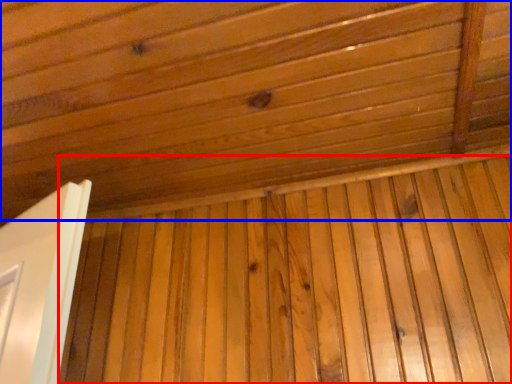
Question: Which object appears farthest to the camera in this image, plywood (highlighted by a red box) or roof (highlighted by a blue box)?

Choices:
 (A) plywood
 (B) roof

Answer: (A)